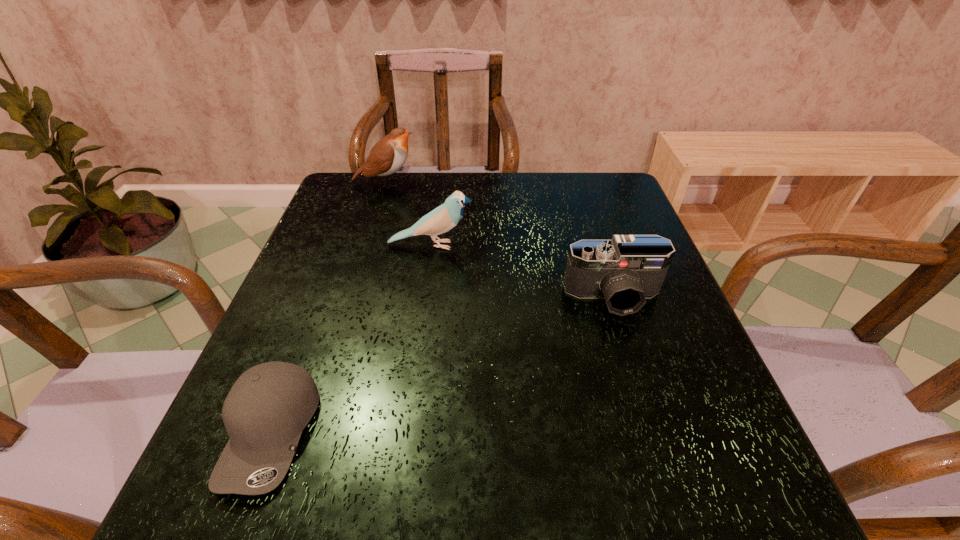
Locate an element on the screen. This screenshot has width=960, height=540. the farthest object is located at coordinates (387, 156).

Identify the location of the second farthest object. The height and width of the screenshot is (540, 960). (443, 218).

Identify the location of the rightmost object. [x=625, y=270].

You are a GUI agent. You are given a task and a screenshot of the screen. Output one action in this format:
    pyautogui.click(x=<x>, y=<y>)
    Task: Click on the second nearest object
    This screenshot has height=540, width=960.
    Given the screenshot: What is the action you would take?
    (625, 270)

Locate an element on the screen. The image size is (960, 540). the shortest object is located at coordinates (266, 410).

Find the location of a particular element. Image resolution: width=960 pixels, height=540 pixels. the nearest object is located at coordinates (266, 410).

Locate an element on the screen. vacant region located 0.340m at the face of the farthest object is located at coordinates (537, 183).

This screenshot has height=540, width=960. I want to click on vacant space located 0.080m at the face of the third nearest object, so click(x=510, y=245).

Where is `vacant space located on the front-facing side of the third farthest object`? This screenshot has width=960, height=540. vacant space located on the front-facing side of the third farthest object is located at coordinates (653, 418).

You are a GUI agent. You are given a task and a screenshot of the screen. Output one action in this format:
    pyautogui.click(x=<x>, y=<y>)
    Task: Click on the object that is at the far edge
    This screenshot has width=960, height=540.
    Given the screenshot: What is the action you would take?
    pyautogui.click(x=387, y=156)